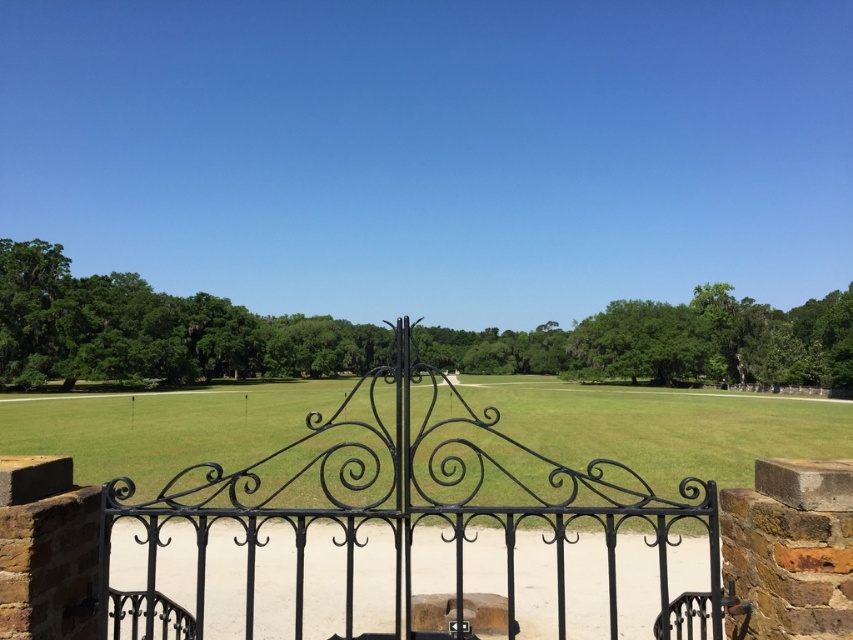
Is black wrought iron gate at center wider than green grass at center?

Incorrect, black wrought iron gate at center's width does not surpass green grass at center's.

Where is `black wrought iron gate at center`? black wrought iron gate at center is located at coordinates (405, 513).